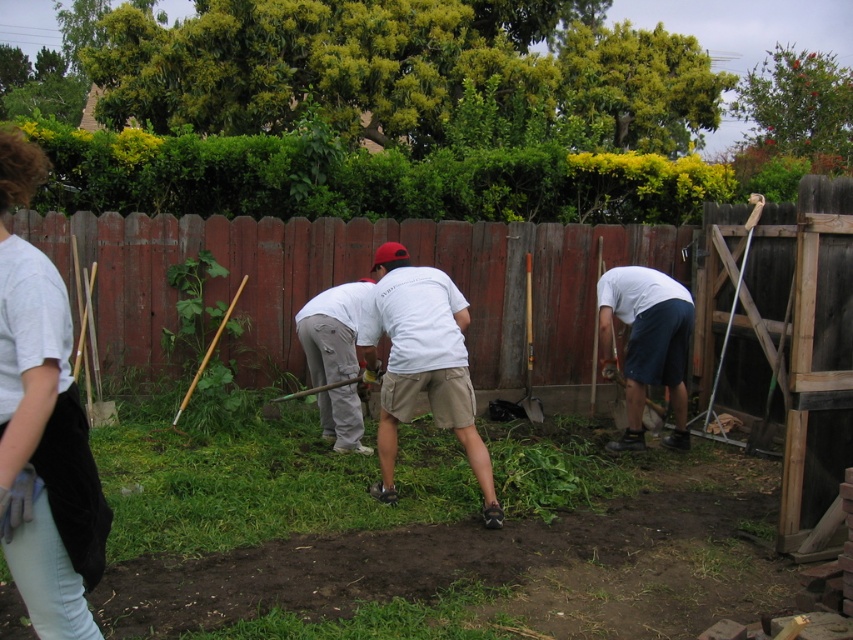
Who is lower down, white cotton shirt at center or white matte shorts at lower right?

white cotton shirt at center is below.

Is white cotton shirt at center closer to camera compared to white matte shorts at lower right?

Yes, white cotton shirt at center is in front of white matte shorts at lower right.

Is point (430, 376) positioned before point (666, 374)?

Yes, point (430, 376) is closer to viewer.

This screenshot has width=853, height=640. I want to click on white cotton shirt at center, so (x=421, y=364).

From the picture: Is light blue jeans at lower left below white cotton shirt at center?

Incorrect, light blue jeans at lower left is not positioned below white cotton shirt at center.

Does light blue jeans at lower left have a greater height compared to white cotton shirt at center?

No, light blue jeans at lower left is not taller than white cotton shirt at center.

Who is more forward, (99, 634) or (405, 368)?

Positioned in front is point (99, 634).

Find the location of `light blue jeans at lower left`. light blue jeans at lower left is located at coordinates (42, 426).

Is the position of light blue jeans at lower left less distant than that of light gray cotton pants at center?

Yes.

Between point (28, 413) and point (323, 365), which one is positioned behind?

The point (323, 365) is behind.

Where is `light blue jeans at lower left`? This screenshot has height=640, width=853. light blue jeans at lower left is located at coordinates (42, 426).